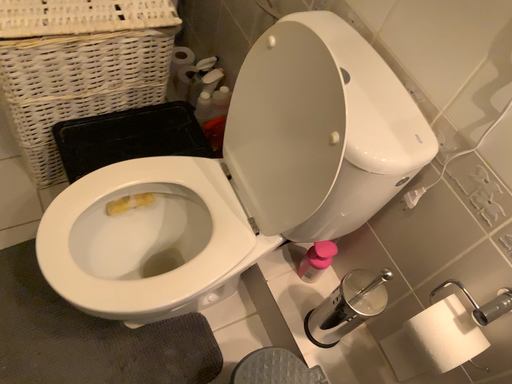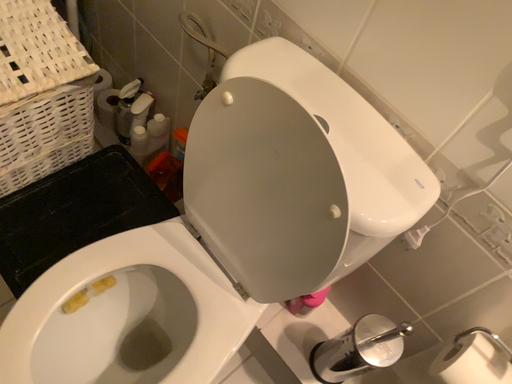
Question: How did the camera likely rotate when shooting the video?

Choices:
 (A) rotated right
 (B) rotated left

Answer: (A)